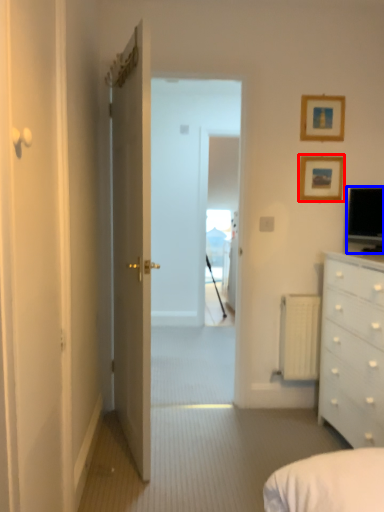
Question: Which object appears farthest to the camera in this image, picture frame (highlighted by a red box) or television (highlighted by a blue box)?

Choices:
 (A) picture frame
 (B) television

Answer: (A)